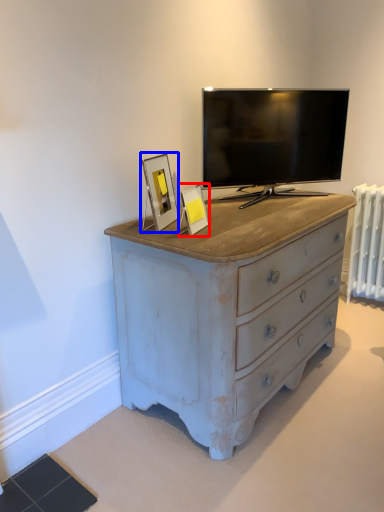
Question: Which object appears closest to the camera in this image, picture frame (highlighted by a red box) or picture frame (highlighted by a blue box)?

Choices:
 (A) picture frame
 (B) picture frame

Answer: (A)